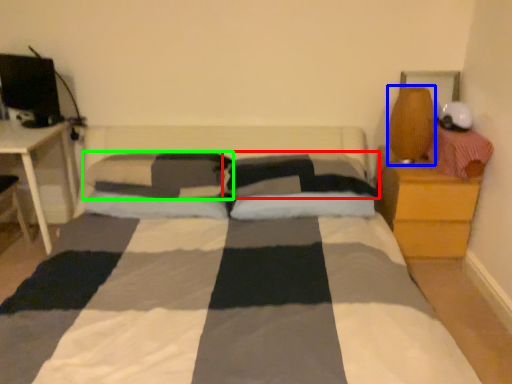
Question: Which is nearer to the pillow (highlighted by a red box)? table lamp (highlighted by a blue box) or pillow (highlighted by a green box).

Choices:
 (A) table lamp
 (B) pillow

Answer: (B)